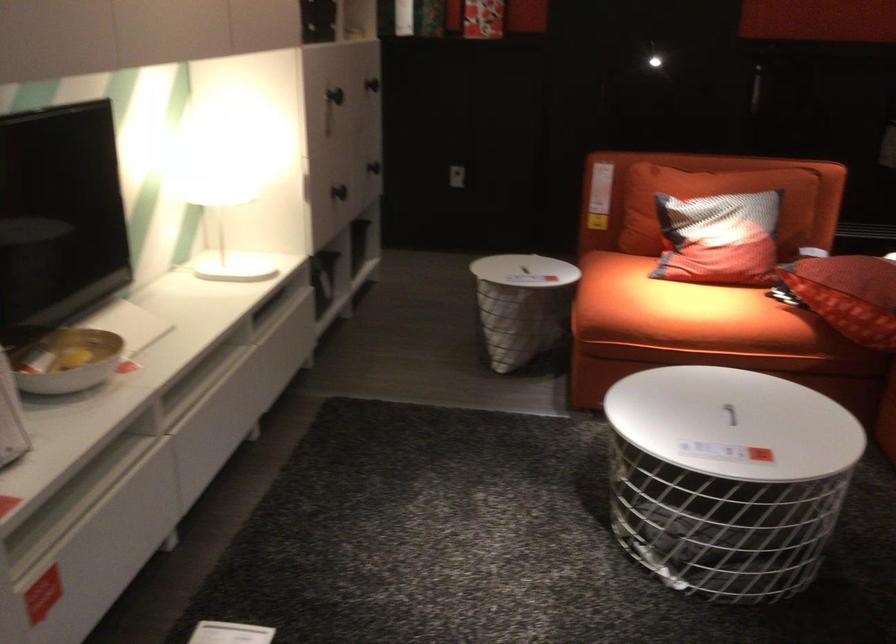
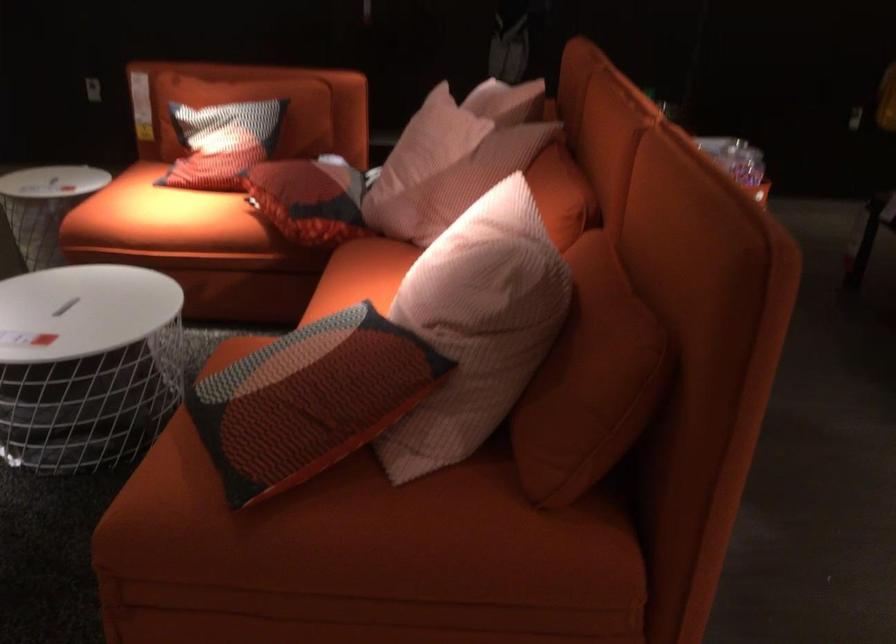
Where in the second image is the point corresponding to the point at 698,310 from the first image?

(160, 216)